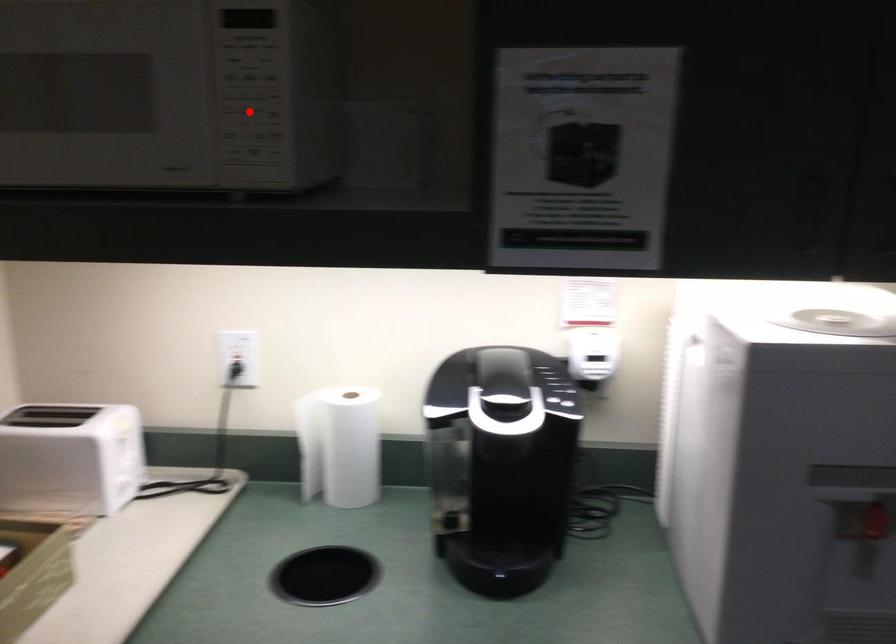
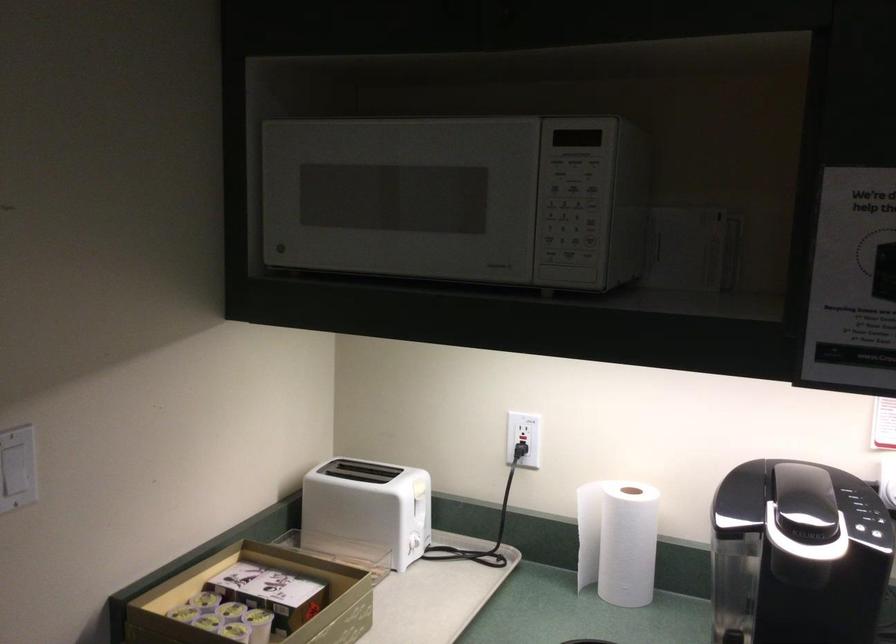
The point at the highlighted location is marked in the first image. Where is the corresponding point in the second image?

(569, 220)